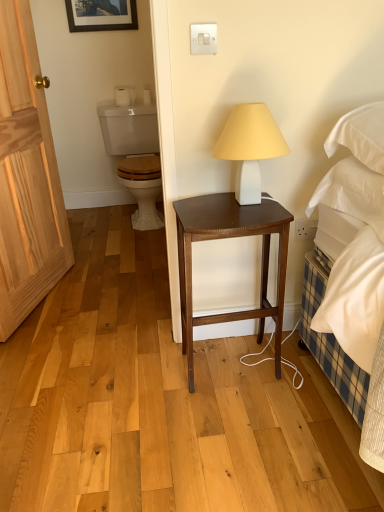
Where is `vacant space situated above dark wood stool at center (from a real-world perspective)`? The height and width of the screenshot is (512, 384). vacant space situated above dark wood stool at center (from a real-world perspective) is located at coordinates (239, 209).